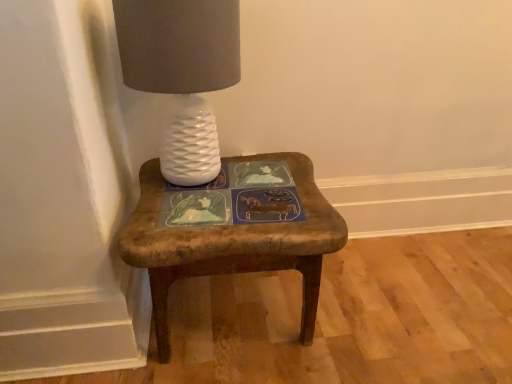
You are a GUI agent. You are given a task and a screenshot of the screen. Output one action in this format:
    pyautogui.click(x=<x>, y=<y>)
    Task: Click on the vacant area that lies to the right of white textured lamp at upper left
    
    Given the screenshot: What is the action you would take?
    pyautogui.click(x=281, y=186)